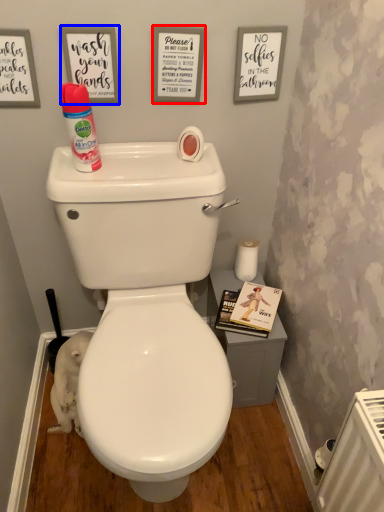
Question: Which object appears closest to the camera in this image, copy (highlighted by a red box) or copy (highlighted by a blue box)?

Choices:
 (A) copy
 (B) copy

Answer: (B)